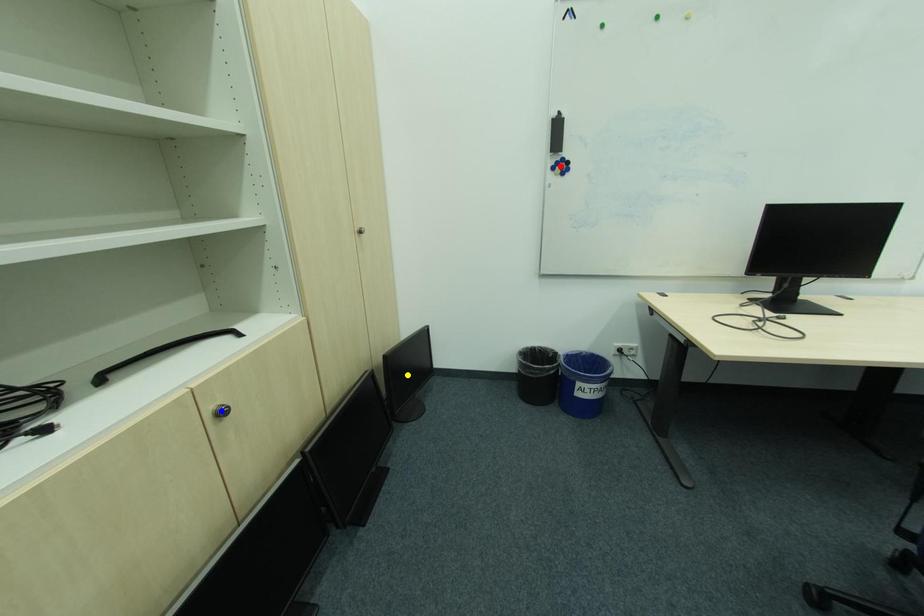
Order these from nearest to farthest:
blue point
red point
yellow point

blue point
red point
yellow point